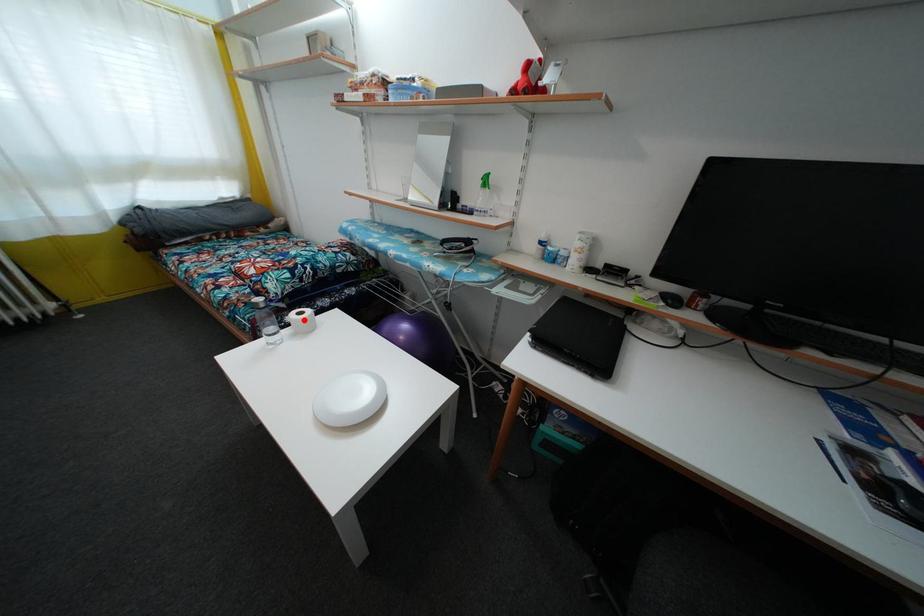
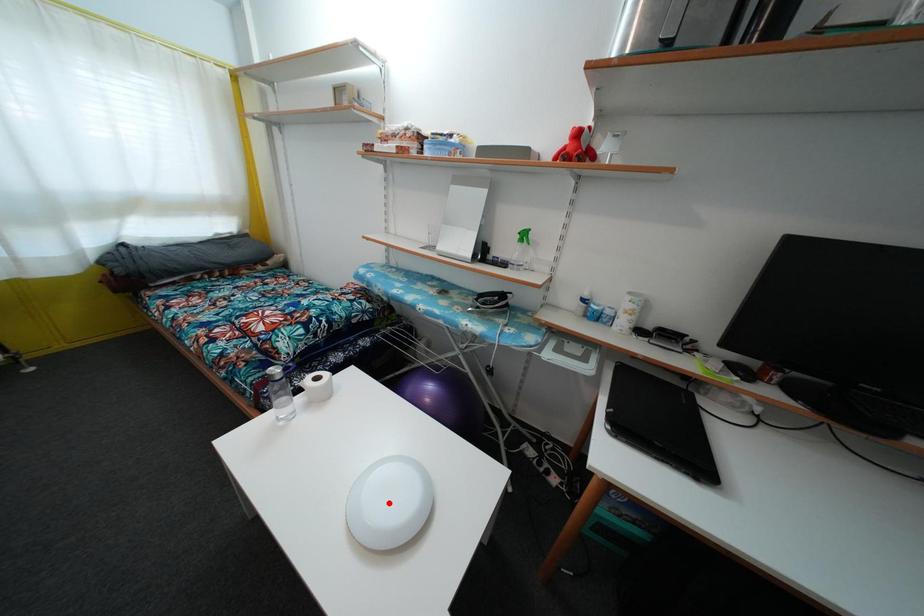
I am providing you with two images of the same scene from different viewpoints. A red point is marked on the first image and another point is marked on the second image. Is the red point in image1 aligned with the point shown in image2?

No